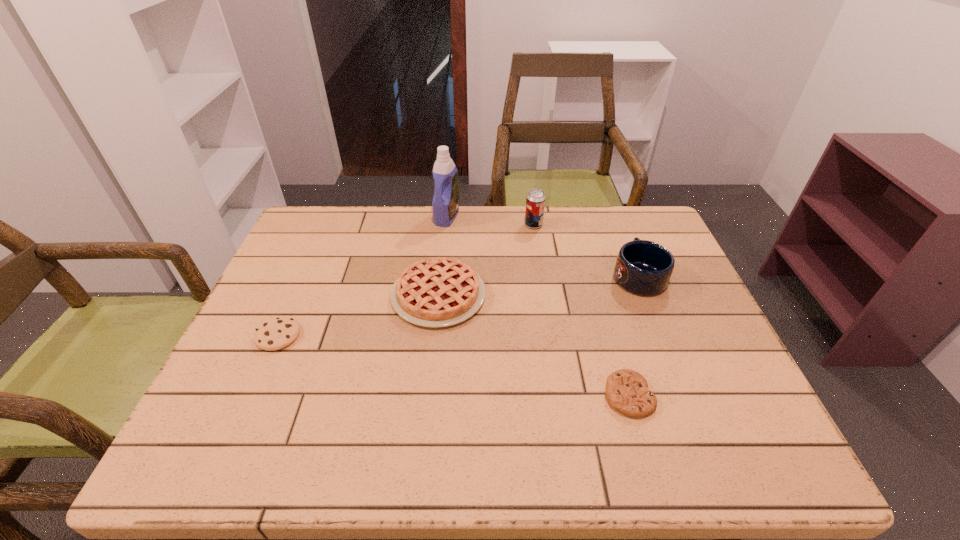
In order to click on unoccupied position between the shortest object and the pie in this screenshot , I will do `click(534, 345)`.

Locate an element on the screen. free space between the fifth shortest object and the right cookie is located at coordinates (581, 310).

The height and width of the screenshot is (540, 960). What are the coordinates of `vacant space in between the mug and the third object from right to left` in the screenshot? It's located at (586, 251).

This screenshot has height=540, width=960. I want to click on vacant space in between the third object from right to left and the fourth tallest object, so click(486, 260).

Locate an element on the screen. This screenshot has height=540, width=960. free area in between the mug and the fourth tallest object is located at coordinates (539, 286).

Locate an element on the screen. blank region between the mug and the fifth shortest object is located at coordinates (586, 251).

The width and height of the screenshot is (960, 540). I want to click on the closest object to the fourth tallest object, so click(445, 203).

What are the coordinates of `object that ranks as the fourth closest to the detergent` in the screenshot? It's located at (276, 333).

The width and height of the screenshot is (960, 540). I want to click on vacant space that satisfies the following two spatial constraints: 1. on the back side of the farther cookie; 2. on the left side of the detergent, so click(x=330, y=217).

Where is `vacant area that satisfies the following two spatial constraints: 1. on the back side of the leftmost object; 2. on the left side of the tallest object`? vacant area that satisfies the following two spatial constraints: 1. on the back side of the leftmost object; 2. on the left side of the tallest object is located at coordinates (330, 217).